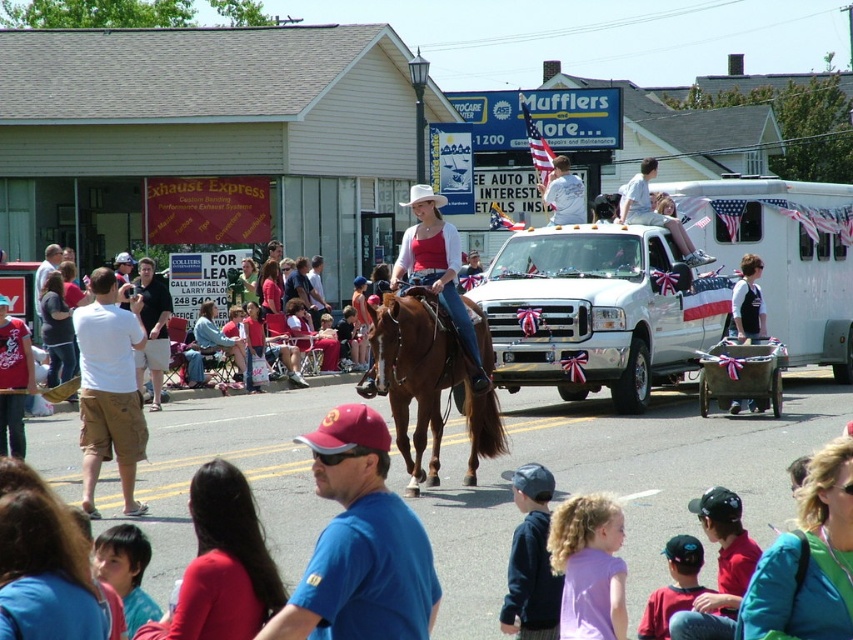
Question: Among these objects, which one is farthest from the camera?

Choices:
 (A) blue fabric shirt at center
 (B) white cotton shirt at left
 (C) dark gray cotton t-shirt at center
 (D) brown glossy horse at center

Answer: (C)

Question: Can you confirm if blue fabric shirt at center is wider than white cotton shirt at left?

Choices:
 (A) no
 (B) yes

Answer: (B)

Question: Which point is closer to the camera?

Choices:
 (A) (399, 602)
 (B) (169, 301)

Answer: (A)

Question: In this image, where is brown glossy horse at center located relative to dark gray cotton t-shirt at center?

Choices:
 (A) right
 (B) left

Answer: (A)

Question: Is blue fabric shirt at center behind brown glossy horse at center?

Choices:
 (A) yes
 (B) no

Answer: (B)

Question: Estimate the real-world distances between objects in this image. Which object is closer to the brown glossy horse at center?

Choices:
 (A) blue fabric shirt at center
 (B) white cotton shirt at left
 (C) dark gray cotton t-shirt at center

Answer: (B)